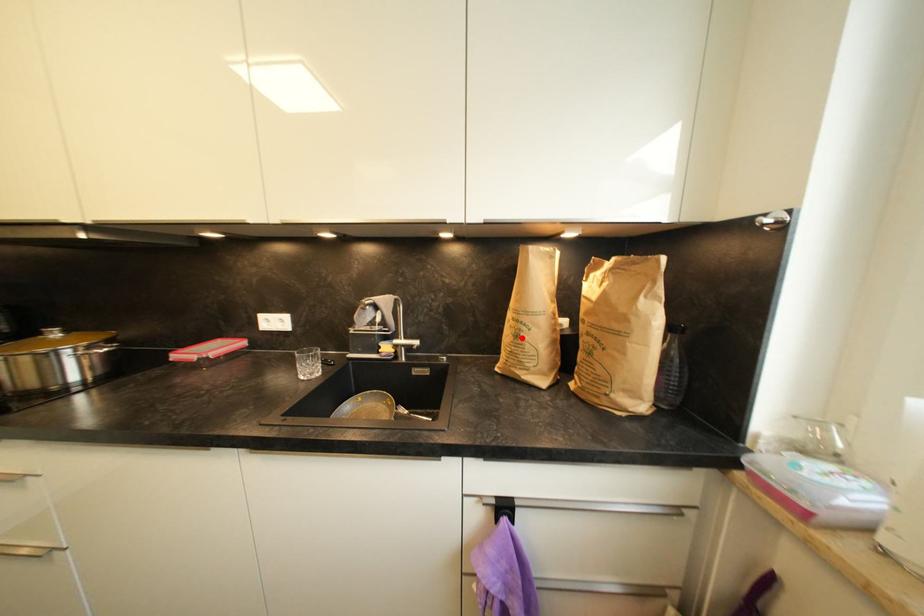
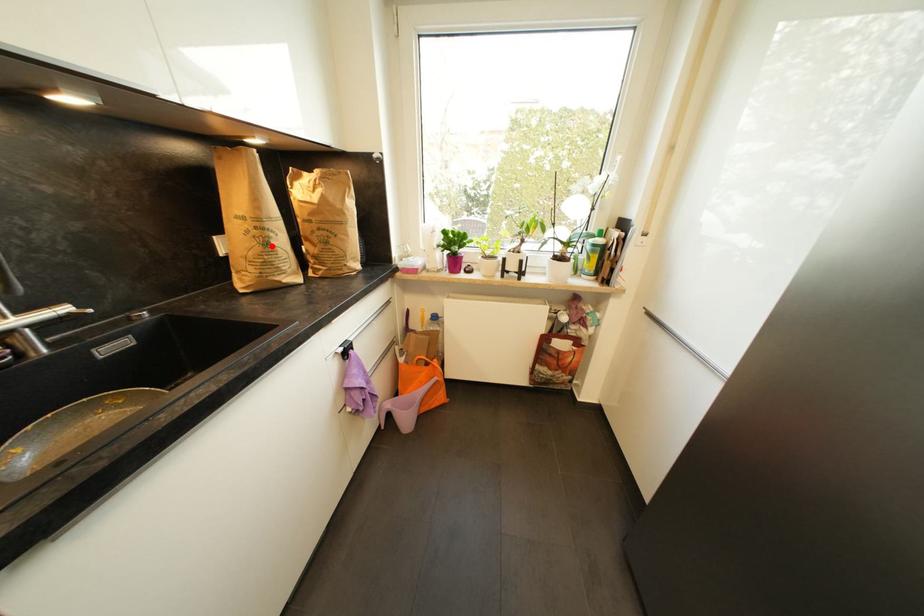
I am providing you with two images of the same scene from different viewpoints. A red point is marked on the first image and another point is marked on the second image. Is the red point in image1 aligned with the point shown in image2?

Yes